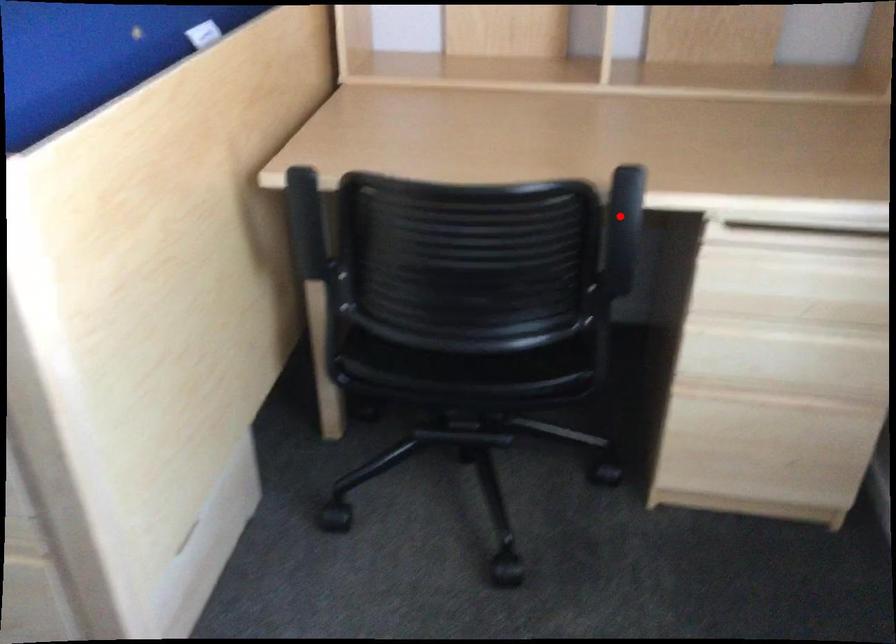
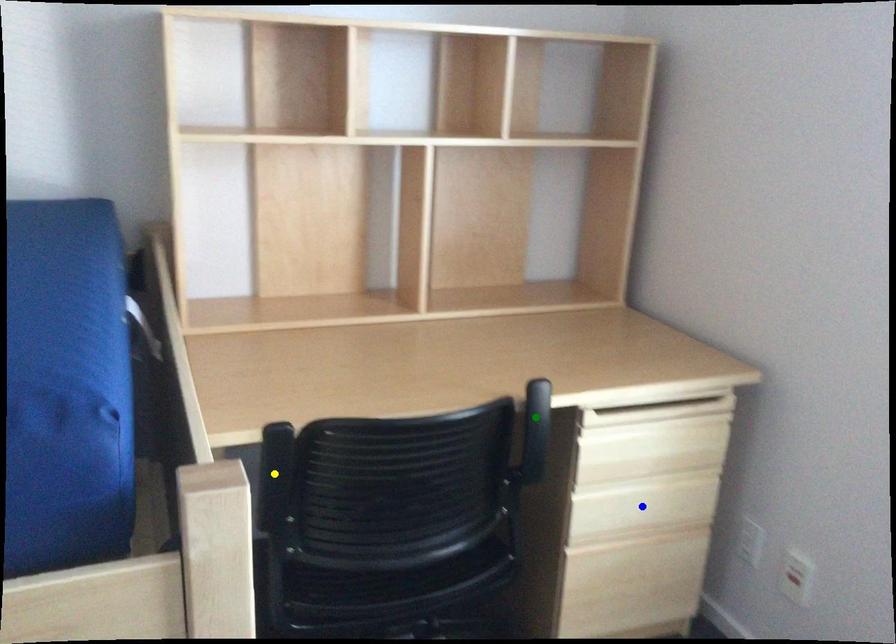
Question: I am providing you with two images of the same scene from different viewpoints. A red point is marked on the first image. You are given multiple points on the second image. Which mark in image 2 goes with the point in image 1?

Choices:
 (A) green point
 (B) yellow point
 (C) blue point

Answer: (A)